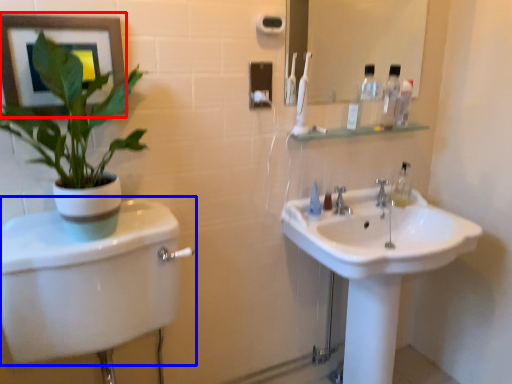
Question: Which of the following is the farthest to the observer, picture frame (highlighted by a red box) or toilet (highlighted by a blue box)?

Choices:
 (A) picture frame
 (B) toilet

Answer: (A)